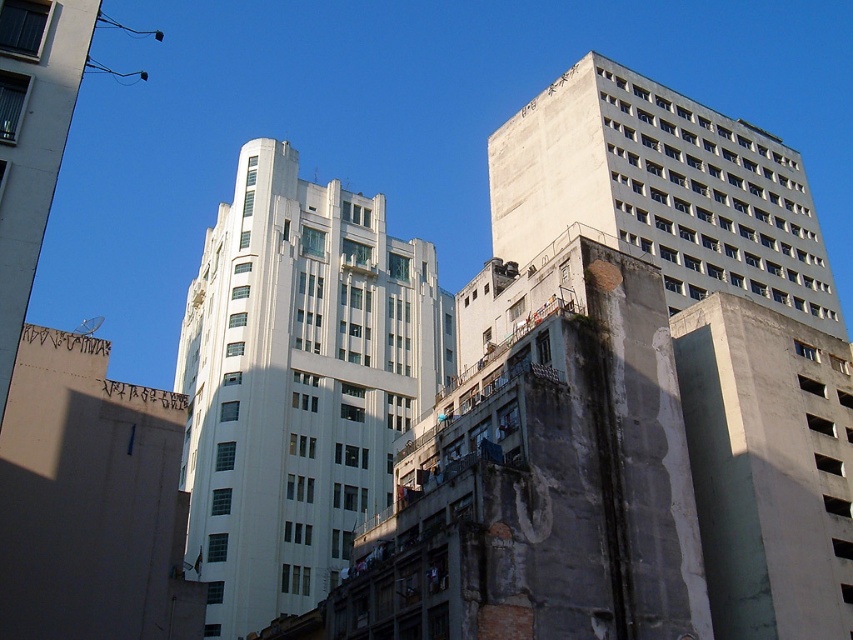
Does white smooth building at center appear under concrete building at upper right?

Correct, white smooth building at center is located below concrete building at upper right.

Image resolution: width=853 pixels, height=640 pixels. Describe the element at coordinates (297, 384) in the screenshot. I see `white smooth building at center` at that location.

Locate an element on the screen. The height and width of the screenshot is (640, 853). white smooth building at center is located at coordinates (297, 384).